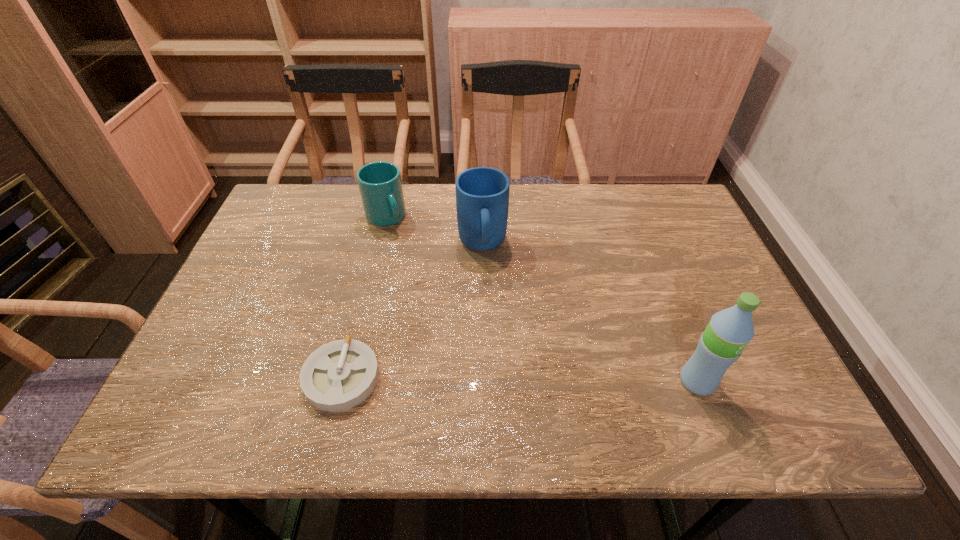
What are the coordinates of `free location at the near edge of the desktop` in the screenshot? It's located at (271, 372).

In the image, there is a desktop. Where is `vacant space at the left edge`? The image size is (960, 540). vacant space at the left edge is located at coordinates (271, 297).

Where is `vacant area at the right edge of the desktop`? vacant area at the right edge of the desktop is located at coordinates (690, 264).

Where is `vacant region at the far left corner`? The width and height of the screenshot is (960, 540). vacant region at the far left corner is located at coordinates (324, 186).

Identify the location of free space at the far right corner. This screenshot has height=540, width=960. (624, 185).

Where is `vacant area that lies between the ashtray and the second object from right to left`? vacant area that lies between the ashtray and the second object from right to left is located at coordinates (412, 311).

Locate an element on the screen. This screenshot has width=960, height=540. vacant region between the third tallest object and the tallest object is located at coordinates (541, 300).

At what (x,y) coordinates should I click in order to perform the action: click on blank region between the cup and the water bottle. Please return your answer as a coordinate pair (x, y). This screenshot has width=960, height=540. Looking at the image, I should click on (541, 300).

You are a GUI agent. You are given a task and a screenshot of the screen. Output one action in this format:
    pyautogui.click(x=<x>, y=<y>)
    Task: Click on the free spot between the tallest object and the third object from left to right
    
    Given the screenshot: What is the action you would take?
    pyautogui.click(x=589, y=313)

You are a GUI agent. You are given a task and a screenshot of the screen. Output one action in this format:
    pyautogui.click(x=<x>, y=<y>)
    Task: Click on the free point between the second tallest object and the shortest object
    The width and height of the screenshot is (960, 540).
    Given the screenshot: What is the action you would take?
    pyautogui.click(x=412, y=311)